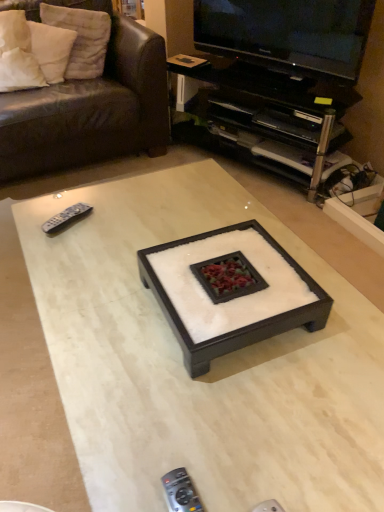
I want to click on vacant area located to the right-hand side of black plastic remote control at lower center, the 2th remote control from the left, so click(x=299, y=479).